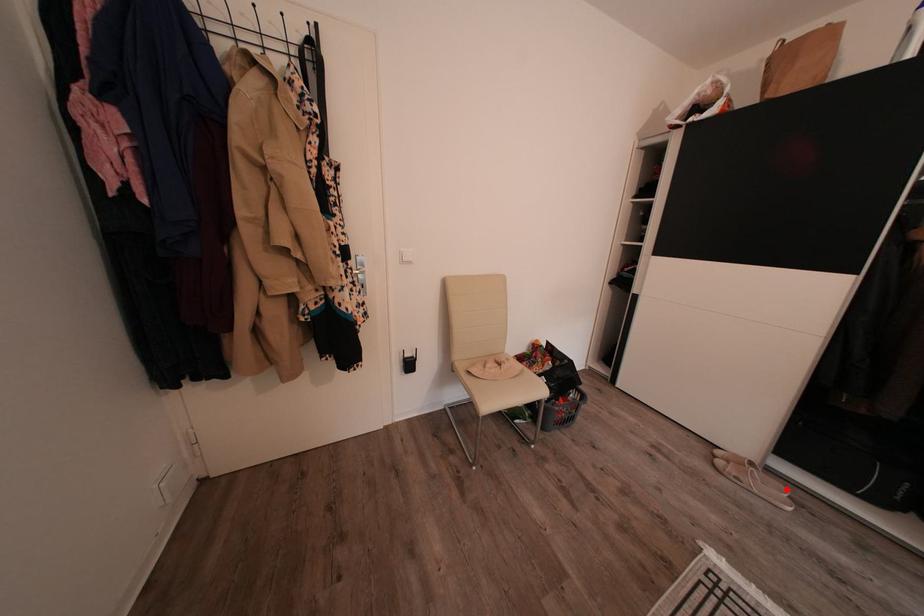
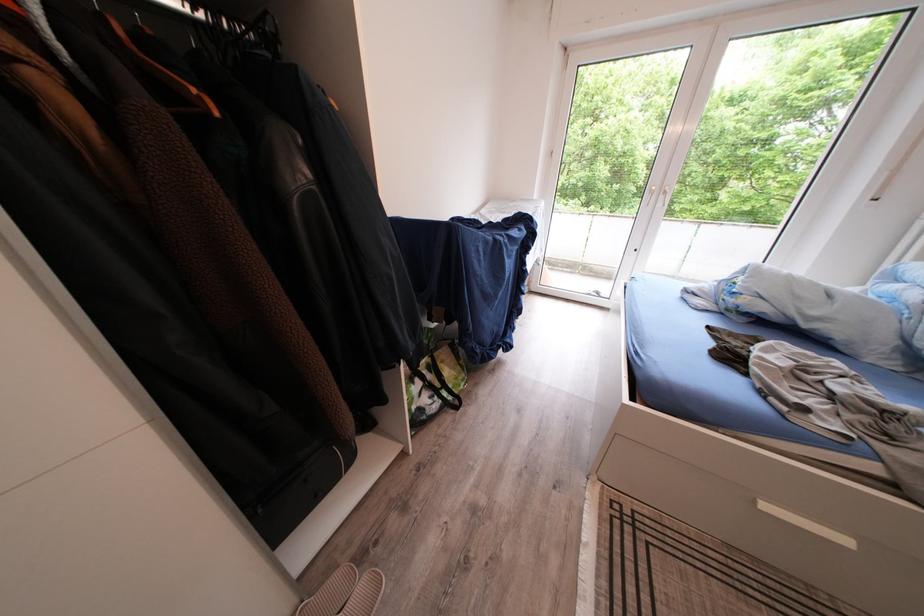
Find the pixel in the second image that matches the highlighted location in the first image.

(347, 583)